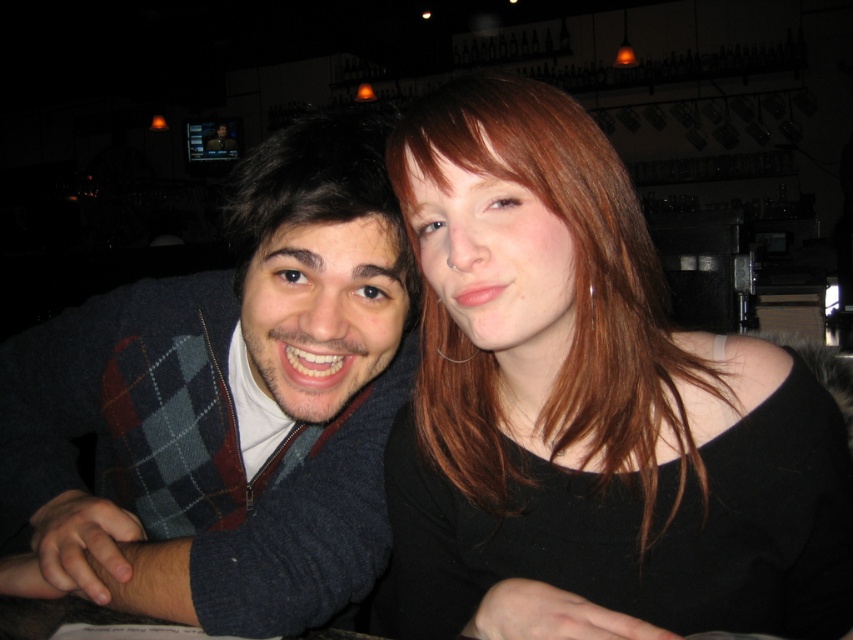
Question: Which object is closer to the camera taking this photo?

Choices:
 (A) dark blue sweater at left
 (B) dark brown smooth hair at left

Answer: (A)

Question: Does dark blue sweater at left appear on the right side of dark brown smooth hair at left?

Choices:
 (A) no
 (B) yes

Answer: (A)

Question: Which point is farther from the camera taking this photo?

Choices:
 (A) (378, 476)
 (B) (573, 513)

Answer: (A)

Question: Is matte black shirt at center to the right of dark brown smooth hair at left from the viewer's perspective?

Choices:
 (A) yes
 (B) no

Answer: (A)

Question: Is matte black shirt at center to the left of dark blue sweater at left from the viewer's perspective?

Choices:
 (A) no
 (B) yes

Answer: (A)

Question: Which point appears farthest from the camera in this image?

Choices:
 (A) (198, 420)
 (B) (344, 200)
 (C) (473, 340)

Answer: (A)